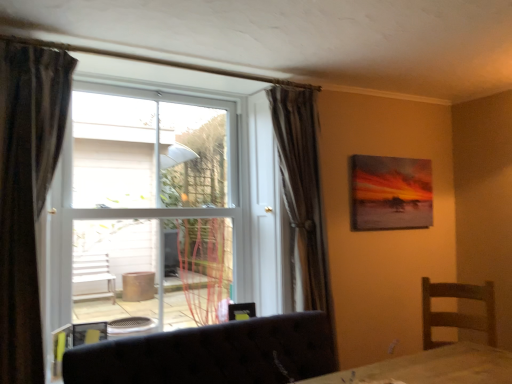
Question: Looking at their shapes, would you say white plastic window at center is wider or thinner than dark fabric curtain at left, the second curtain from the back?

Choices:
 (A) wide
 (B) thin

Answer: (A)

Question: Visually, is white plastic window at center positioned to the left or to the right of dark fabric curtain at left, which ranks as the first curtain in left-to-right order?

Choices:
 (A) left
 (B) right

Answer: (B)

Question: Which object is the farthest from the dark fabric couch at lower center?

Choices:
 (A) dark fabric curtain at left, the first curtain from the front
 (B) matte canvas painting at upper right
 (C) white plastic window at center
 (D) silky brown curtain at center, which is the 2th curtain in left-to-right order

Answer: (B)

Question: Which is farther from the silky brown curtain at center, the first curtain positioned from the right?

Choices:
 (A) dark fabric couch at lower center
 (B) white plastic window at center
 (C) dark fabric curtain at left, the second curtain from the back
 (D) matte canvas painting at upper right

Answer: (C)